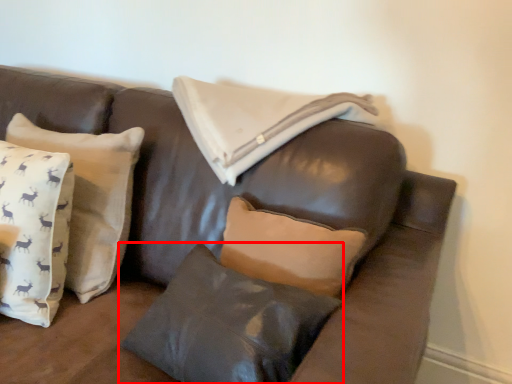
Question: From the image's perspective, what is the correct spatial relationship of pillow (annotated by the red box) in relation to pillow?

Choices:
 (A) below
 (B) above

Answer: (A)